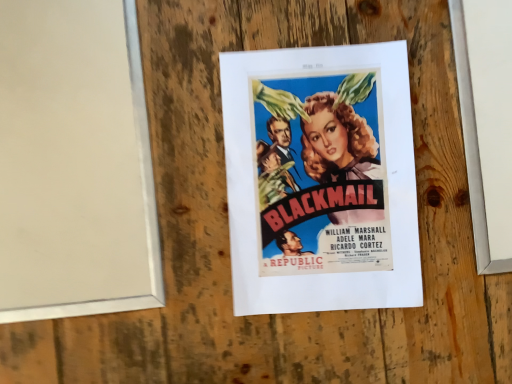
What do you see at coordinates (321, 179) in the screenshot? The height and width of the screenshot is (384, 512). I see `matte paper poster at center` at bounding box center [321, 179].

Find the location of a particular element. matte paper poster at center is located at coordinates (321, 179).

Find the location of `matte paper poster at center`. matte paper poster at center is located at coordinates (321, 179).